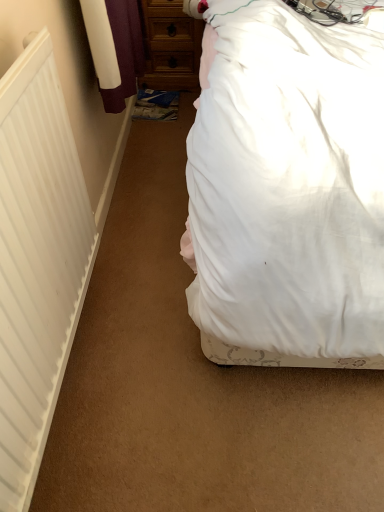
Question: Is white matte radiator at left not within white fabric bed at upper right?

Choices:
 (A) yes
 (B) no

Answer: (A)

Question: Is white matte radiator at left to the left of white fabric bed at upper right from the viewer's perspective?

Choices:
 (A) no
 (B) yes

Answer: (B)

Question: From a real-world perspective, is white matte radiator at left under white fabric bed at upper right?

Choices:
 (A) yes
 (B) no

Answer: (A)

Question: Would you say white matte radiator at left contains white fabric bed at upper right?

Choices:
 (A) no
 (B) yes

Answer: (A)

Question: Is white fabric bed at upper right at the back of white matte radiator at left?

Choices:
 (A) no
 (B) yes

Answer: (A)

Question: Can you confirm if white matte radiator at left is positioned to the right of white fabric bed at upper right?

Choices:
 (A) no
 (B) yes

Answer: (A)

Question: From a real-world perspective, is white fabric bed at upper right located beneath wooden chest of drawers at upper center?

Choices:
 (A) yes
 (B) no

Answer: (B)

Question: Is white fabric bed at upper right bigger than wooden chest of drawers at upper center?

Choices:
 (A) yes
 (B) no

Answer: (A)

Question: Is white fabric bed at upper right outside wooden chest of drawers at upper center?

Choices:
 (A) yes
 (B) no

Answer: (A)

Question: Does white fabric bed at upper right have a greater width compared to wooden chest of drawers at upper center?

Choices:
 (A) no
 (B) yes

Answer: (B)

Question: From a real-world perspective, is white fabric bed at upper right positioned over wooden chest of drawers at upper center based on gravity?

Choices:
 (A) yes
 (B) no

Answer: (A)

Question: Would you say white fabric bed at upper right contains wooden chest of drawers at upper center?

Choices:
 (A) no
 (B) yes

Answer: (A)

Question: Considering the relative positions of wooden chest of drawers at upper center and white matte radiator at left in the image provided, is wooden chest of drawers at upper center to the left of white matte radiator at left from the viewer's perspective?

Choices:
 (A) no
 (B) yes

Answer: (A)